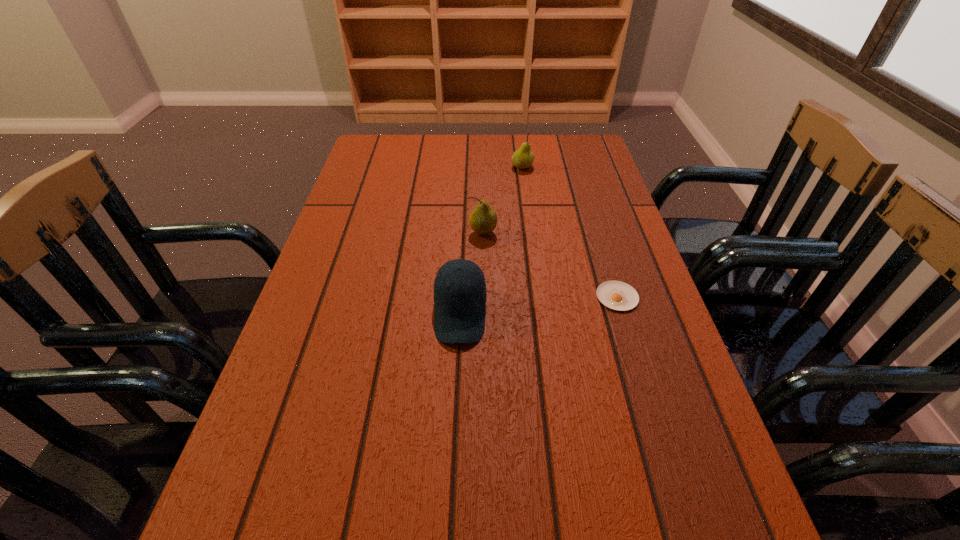
I want to click on the farther pear, so click(522, 158).

This screenshot has width=960, height=540. What are the coordinates of `the third object from left to right` in the screenshot? It's located at (522, 158).

Where is `baseball cap`? The height and width of the screenshot is (540, 960). baseball cap is located at coordinates (460, 296).

Where is `the third nearest object`? Image resolution: width=960 pixels, height=540 pixels. the third nearest object is located at coordinates (483, 219).

Where is `the nearer pear`? the nearer pear is located at coordinates (483, 219).

The width and height of the screenshot is (960, 540). In order to click on the shortest object in this screenshot , I will do click(617, 295).

Identify the location of the rightmost object. (617, 295).

Image resolution: width=960 pixels, height=540 pixels. I want to click on vacant space located 0.120m on the left of the farther pear, so click(x=472, y=167).

This screenshot has width=960, height=540. In order to click on blank area located 0.320m on the front-facing side of the baseball cap in this screenshot , I will do `click(451, 531)`.

Identify the location of free point located 0.330m on the right of the left pear. This screenshot has width=960, height=540. (628, 232).